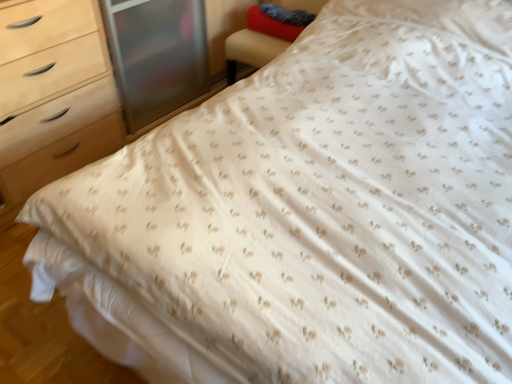
Identify the location of velvet-like red pillow at upper right, which appears as the second pillow when viewed from the front. Image resolution: width=512 pixels, height=384 pixels. (278, 21).

The image size is (512, 384). Identify the location of velvet blue pillow at upper right, positioned as the 2th pillow in back-to-front order. (287, 14).

Between velvet-like red pillow at upper right, which appears as the second pillow when viewed from the front, and red fabric armchair at upper right, which one has smaller width?

Thinner between the two is velvet-like red pillow at upper right, which appears as the second pillow when viewed from the front.

Considering the sizes of objects velvet-like red pillow at upper right, arranged as the first pillow when viewed from the back, and red fabric armchair at upper right in the image provided, who is smaller, velvet-like red pillow at upper right, arranged as the first pillow when viewed from the back, or red fabric armchair at upper right?

velvet-like red pillow at upper right, arranged as the first pillow when viewed from the back.

How many degrees apart are the facing directions of velvet-like red pillow at upper right, which appears as the second pillow when viewed from the front, and red fabric armchair at upper right?

The angle between the facing direction of velvet-like red pillow at upper right, which appears as the second pillow when viewed from the front, and the facing direction of red fabric armchair at upper right is 0.449 degrees.

Which of these two, velvet blue pillow at upper right, which is the first pillow in front-to-back order, or velvet-like red pillow at upper right, arranged as the first pillow when viewed from the back, stands shorter?

velvet blue pillow at upper right, which is the first pillow in front-to-back order.

Which of these two, velvet blue pillow at upper right, positioned as the 2th pillow in back-to-front order, or velvet-like red pillow at upper right, arranged as the first pillow when viewed from the back, is bigger?

velvet-like red pillow at upper right, arranged as the first pillow when viewed from the back, is bigger.

Between velvet blue pillow at upper right, positioned as the 2th pillow in back-to-front order, and velvet-like red pillow at upper right, which appears as the second pillow when viewed from the front, which one appears on the left side from the viewer's perspective?

velvet blue pillow at upper right, positioned as the 2th pillow in back-to-front order, is more to the left.

Is velvet blue pillow at upper right, positioned as the 2th pillow in back-to-front order, not within velvet-like red pillow at upper right, which appears as the second pillow when viewed from the front?

Yes.

Looking at this image, considering the sizes of velvet-like red pillow at upper right, arranged as the first pillow when viewed from the back, and velvet blue pillow at upper right, which is the first pillow in front-to-back order, in the image, is velvet-like red pillow at upper right, arranged as the first pillow when viewed from the back, taller or shorter than velvet blue pillow at upper right, which is the first pillow in front-to-back order,?

Clearly, velvet-like red pillow at upper right, arranged as the first pillow when viewed from the back, is taller compared to velvet blue pillow at upper right, which is the first pillow in front-to-back order.

From the image's perspective, is velvet-like red pillow at upper right, arranged as the first pillow when viewed from the back, under velvet blue pillow at upper right, which is the first pillow in front-to-back order?

Yes, from the image's perspective, velvet-like red pillow at upper right, arranged as the first pillow when viewed from the back, is beneath velvet blue pillow at upper right, which is the first pillow in front-to-back order.

Could you tell me if velvet-like red pillow at upper right, which appears as the second pillow when viewed from the front, is facing velvet blue pillow at upper right, positioned as the 2th pillow in back-to-front order?

No, velvet-like red pillow at upper right, which appears as the second pillow when viewed from the front, is not aimed at velvet blue pillow at upper right, positioned as the 2th pillow in back-to-front order.

Based on their sizes in the image, would you say velvet-like red pillow at upper right, which appears as the second pillow when viewed from the front, is bigger or smaller than velvet blue pillow at upper right, which is the first pillow in front-to-back order?

Clearly, velvet-like red pillow at upper right, which appears as the second pillow when viewed from the front, is larger in size than velvet blue pillow at upper right, which is the first pillow in front-to-back order.

How many degrees apart are the facing directions of velvet blue pillow at upper right, positioned as the 2th pillow in back-to-front order, and red fabric armchair at upper right?

They differ by 0.449 degrees in their facing directions.

Consider the image. Is velvet blue pillow at upper right, which is the first pillow in front-to-back order, positioned with its back to red fabric armchair at upper right?

Absolutely, velvet blue pillow at upper right, which is the first pillow in front-to-back order, is directed away from red fabric armchair at upper right.

Considering the relative positions of velvet blue pillow at upper right, positioned as the 2th pillow in back-to-front order, and red fabric armchair at upper right in the image provided, is velvet blue pillow at upper right, positioned as the 2th pillow in back-to-front order, to the left of red fabric armchair at upper right from the viewer's perspective?

Correct, you'll find velvet blue pillow at upper right, positioned as the 2th pillow in back-to-front order, to the left of red fabric armchair at upper right.

Is velvet blue pillow at upper right, which is the first pillow in front-to-back order, not near red fabric armchair at upper right?

No.

Where is `the 2nd pillow positioned above the red fabric armchair at upper right (from a real-world perspective)`? the 2nd pillow positioned above the red fabric armchair at upper right (from a real-world perspective) is located at coordinates (287, 14).

Is velvet blue pillow at upper right, positioned as the 2th pillow in back-to-front order, inside red fabric armchair at upper right?

Yes, red fabric armchair at upper right contains velvet blue pillow at upper right, positioned as the 2th pillow in back-to-front order.

From the image's perspective, which one is positioned higher, red fabric armchair at upper right or velvet blue pillow at upper right, positioned as the 2th pillow in back-to-front order?

velvet blue pillow at upper right, positioned as the 2th pillow in back-to-front order, from the image's perspective.

Is red fabric armchair at upper right thinner than velvet-like red pillow at upper right, arranged as the first pillow when viewed from the back?

No.

Could you tell me if red fabric armchair at upper right is facing velvet-like red pillow at upper right, arranged as the first pillow when viewed from the back?

Yes, red fabric armchair at upper right faces towards velvet-like red pillow at upper right, arranged as the first pillow when viewed from the back.

How many degrees apart are the facing directions of red fabric armchair at upper right and velvet-like red pillow at upper right, arranged as the first pillow when viewed from the back?

They differ by 0.449 degrees in their facing directions.

Is red fabric armchair at upper right to the left of velvet-like red pillow at upper right, which appears as the second pillow when viewed from the front, from the viewer's perspective?

No, red fabric armchair at upper right is not to the left of velvet-like red pillow at upper right, which appears as the second pillow when viewed from the front.

From a real-world perspective, starting from the red fabric armchair at upper right, which pillow is the 1st one vertically above it? Please provide its 2D coordinates.

[(278, 21)]

Where is `pillow located below the velvet blue pillow at upper right, positioned as the 2th pillow in back-to-front order (from the image's perspective)`? Image resolution: width=512 pixels, height=384 pixels. pillow located below the velvet blue pillow at upper right, positioned as the 2th pillow in back-to-front order (from the image's perspective) is located at coordinates (278, 21).

Estimate the real-world distances between objects in this image. Which object is further from velvet-like red pillow at upper right, arranged as the first pillow when viewed from the back, velvet blue pillow at upper right, which is the first pillow in front-to-back order, or red fabric armchair at upper right?

red fabric armchair at upper right is positioned further to the anchor velvet-like red pillow at upper right, arranged as the first pillow when viewed from the back.

Considering their positions, is velvet-like red pillow at upper right, which appears as the second pillow when viewed from the front, positioned closer to red fabric armchair at upper right than velvet blue pillow at upper right, positioned as the 2th pillow in back-to-front order?

velvet-like red pillow at upper right, which appears as the second pillow when viewed from the front, lies closer to red fabric armchair at upper right than the other object.

Estimate the real-world distances between objects in this image. Which object is further from red fabric armchair at upper right, velvet blue pillow at upper right, positioned as the 2th pillow in back-to-front order, or velvet-like red pillow at upper right, which appears as the second pillow when viewed from the front?

velvet blue pillow at upper right, positioned as the 2th pillow in back-to-front order, is positioned further to the anchor red fabric armchair at upper right.

Which object lies nearer to the anchor point velvet-like red pillow at upper right, arranged as the first pillow when viewed from the back, red fabric armchair at upper right or velvet blue pillow at upper right, which is the first pillow in front-to-back order?

velvet blue pillow at upper right, which is the first pillow in front-to-back order, is closer to velvet-like red pillow at upper right, arranged as the first pillow when viewed from the back.

When comparing their distances from velvet blue pillow at upper right, positioned as the 2th pillow in back-to-front order, does red fabric armchair at upper right or velvet-like red pillow at upper right, arranged as the first pillow when viewed from the back, seem further?

red fabric armchair at upper right is further to velvet blue pillow at upper right, positioned as the 2th pillow in back-to-front order.

From the image, which object appears to be nearer to velvet blue pillow at upper right, which is the first pillow in front-to-back order, velvet-like red pillow at upper right, which appears as the second pillow when viewed from the front, or red fabric armchair at upper right?

Based on the image, velvet-like red pillow at upper right, which appears as the second pillow when viewed from the front, appears to be nearer to velvet blue pillow at upper right, which is the first pillow in front-to-back order.

Identify the location of pillow between red fabric armchair at upper right and velvet-like red pillow at upper right, arranged as the first pillow when viewed from the back, along the z-axis. (287, 14).